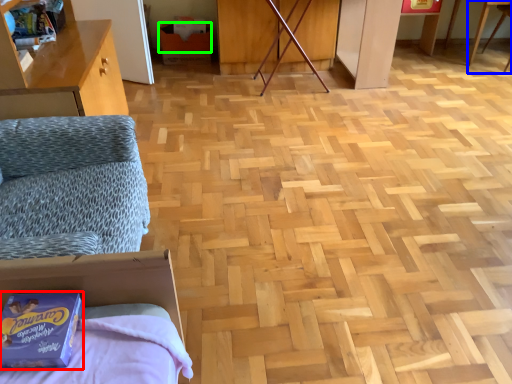
Question: Which object is the farthest from package (highlighted by a red box)? Choose among these: table (highlighted by a blue box) or cardboard box (highlighted by a green box).

Choices:
 (A) table
 (B) cardboard box

Answer: (A)